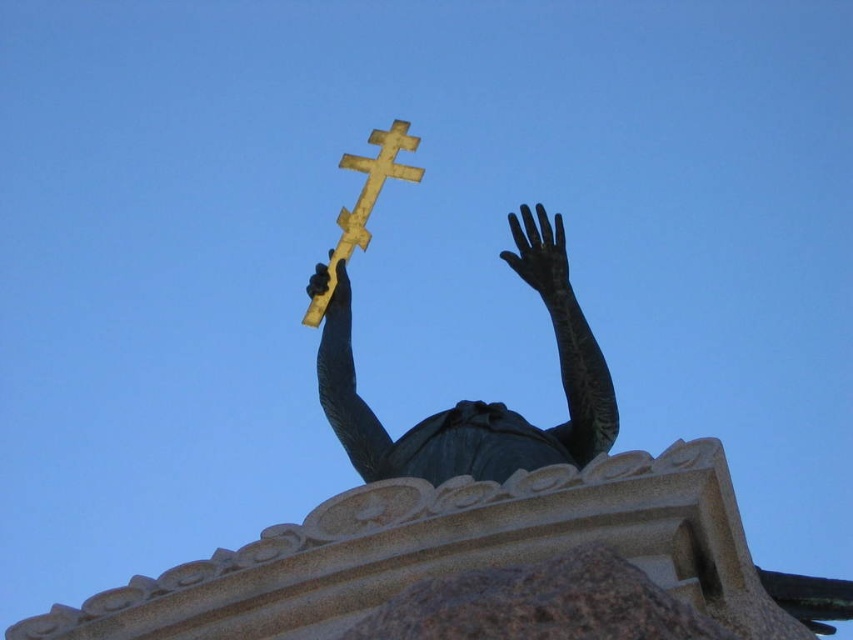
Question: Estimate the real-world distances between objects in this image. Which object is farther from the shiny bronze hand at upper center?

Choices:
 (A) black matte hand at upper center
 (B) gold polished wood cross at upper center

Answer: (A)

Question: Which object is farther from the camera taking this photo?

Choices:
 (A) black matte hand at upper center
 (B) shiny bronze hand at upper center
 (C) bronze statue at center
 (D) gold polished wood cross at upper center

Answer: (B)

Question: Is bronze statue at center further to camera compared to shiny bronze hand at upper center?

Choices:
 (A) no
 (B) yes

Answer: (A)

Question: Which object is farther from the camera taking this photo?

Choices:
 (A) black matte hand at upper center
 (B) shiny bronze hand at upper center
 (C) bronze statue at center

Answer: (B)

Question: Is bronze statue at center above black matte hand at upper center?

Choices:
 (A) yes
 (B) no

Answer: (B)

Question: Considering the relative positions of black matte hand at upper center and shiny bronze hand at upper center in the image provided, where is black matte hand at upper center located with respect to shiny bronze hand at upper center?

Choices:
 (A) below
 (B) above

Answer: (A)